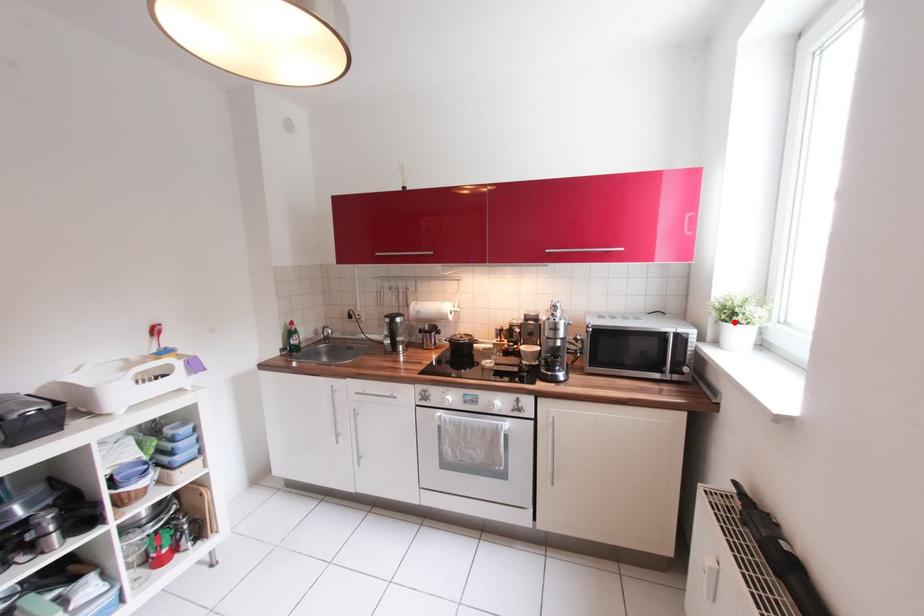
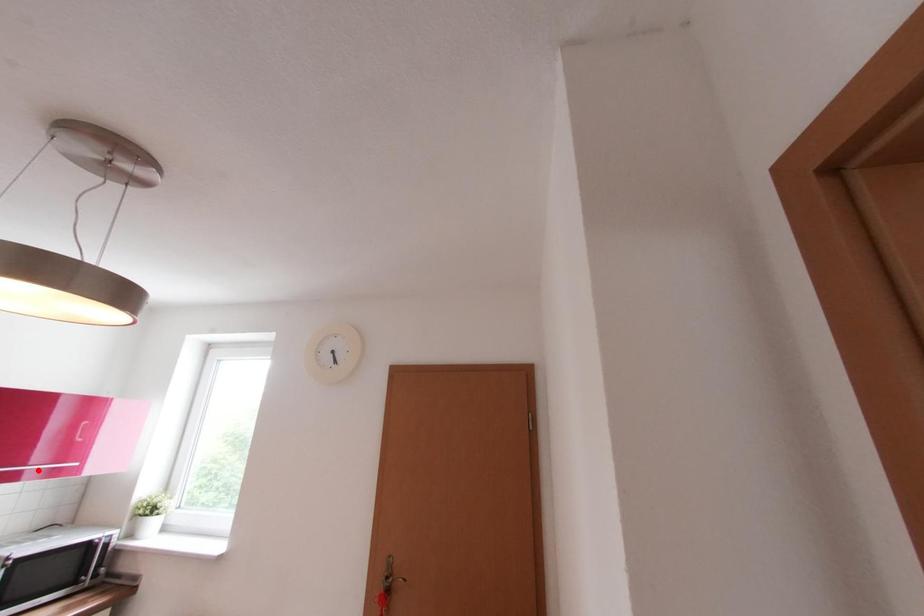
Looking at this image, I am providing you with two images of the same scene from different viewpoints. A red point is marked on the first image and another point is marked on the second image. Are the points marked in image1 and image2 representing the same 3D position?

No